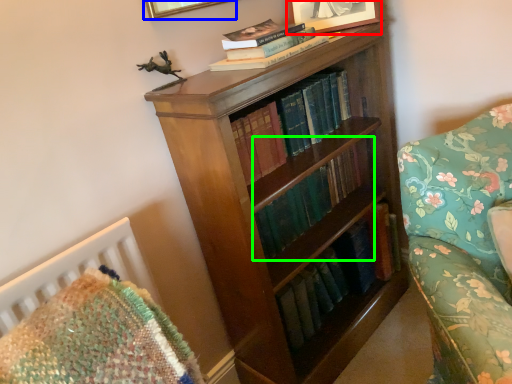
Question: Which object is positioned farthest from picture frame (highlighted by a red box)? Select from picture frame (highlighted by a blue box) and book (highlighted by a green box).

Choices:
 (A) picture frame
 (B) book

Answer: (B)